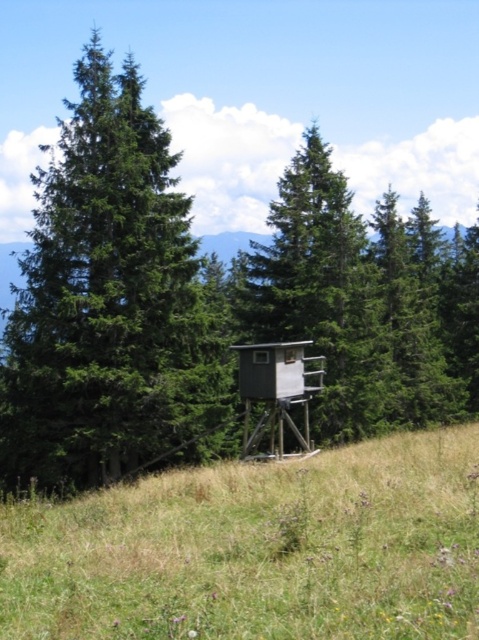
Question: Estimate the real-world distances between objects in this image. Which object is closer to the green matte tree at left?

Choices:
 (A) gray wooden hut at center
 (B) green grassy at center

Answer: (A)

Question: Is green grassy at center thinner than gray wooden hut at center?

Choices:
 (A) yes
 (B) no

Answer: (B)

Question: Which object is farther from the camera taking this photo?

Choices:
 (A) green grassy at center
 (B) green matte tree at left

Answer: (B)

Question: Can you confirm if green grassy at center is positioned to the left of green matte tree at left?

Choices:
 (A) yes
 (B) no

Answer: (B)

Question: Is green matte tree at center to the right of green grassy at center from the viewer's perspective?

Choices:
 (A) yes
 (B) no

Answer: (A)

Question: Which point is farther to the camera?

Choices:
 (A) (445, 636)
 (B) (281, 352)
 (C) (125, 275)

Answer: (C)